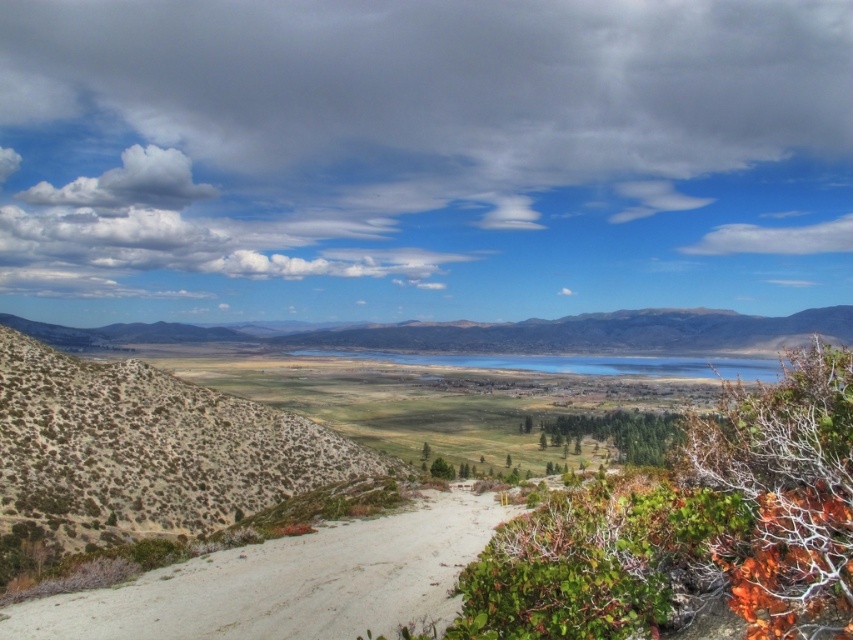
Question: Does deserted shrubbery at left have a smaller size compared to white sandy dirt track at lower left?

Choices:
 (A) yes
 (B) no

Answer: (B)

Question: Which point is closer to the camera taking this photo?

Choices:
 (A) (438, 554)
 (B) (677, 312)

Answer: (A)

Question: Which object appears farthest from the camera in this image?

Choices:
 (A) rugged brown mountain at center
 (B) deserted shrubbery at left
 (C) white sandy dirt track at lower left
 (D) green grassy field at center

Answer: (A)

Question: Is deserted shrubbery at left bigger than white sandy dirt track at lower left?

Choices:
 (A) yes
 (B) no

Answer: (A)

Question: Which object is the farthest from the rugged brown mountain at center?

Choices:
 (A) white sandy dirt track at lower left
 (B) deserted shrubbery at left

Answer: (A)

Question: From the image, what is the correct spatial relationship of green grassy field at center in relation to deserted shrubbery at left?

Choices:
 (A) right
 (B) left

Answer: (A)